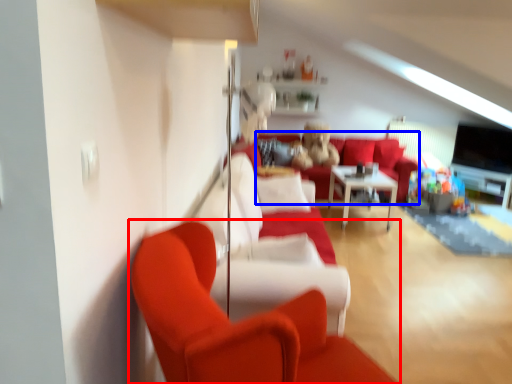
Question: Which object appears farthest to the camera in this image, studio couch (highlighted by a red box) or couch (highlighted by a blue box)?

Choices:
 (A) studio couch
 (B) couch

Answer: (B)